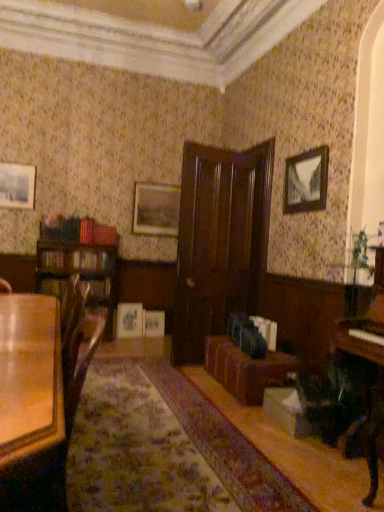
Describe the element at coordinates (156, 209) in the screenshot. I see `matte silver picture frame at center, which is the third picture frame from bottom to top` at that location.

You are a GUI agent. You are given a task and a screenshot of the screen. Output one action in this format:
    pyautogui.click(x=<x>, y=<y>)
    Task: Click on the dark wood door at center
    
    Given the screenshot: What is the action you would take?
    pyautogui.click(x=219, y=241)

What do you see at coordinates (219, 241) in the screenshot? This screenshot has width=384, height=512. I see `dark wood door at center` at bounding box center [219, 241].

What do you see at coordinates (30, 404) in the screenshot? I see `glossy wood table at lower left` at bounding box center [30, 404].

I want to click on matte wooden picture frame at center, the fifth picture frame from the front, so click(153, 323).

Measure the distance between point (27, 188) and camera.

Point (27, 188) is 15.63 feet away from camera.

Locate an element on the screen. The width and height of the screenshot is (384, 512). matte silver picture frame at center, the 3th picture frame in the top-to-bottom sequence is located at coordinates coord(156,209).

Is matte wooden picture frame at center, marked as the fifth picture frame in a top-to-bottom arrangement, placed right next to brown leather couch at center?

They are not placed beside each other.

Is matte wooden picture frame at center, marked as the fifth picture frame in a top-to-bottom arrangement, completely or partially outside of brown leather couch at center?

Yes, matte wooden picture frame at center, marked as the fifth picture frame in a top-to-bottom arrangement, is not within brown leather couch at center.

Is matte wooden picture frame at center, the fifth picture frame from the front, looking in the opposite direction of brown leather couch at center?

No.

Does brown leather couch at center have a greater width compared to wooden picture frame at upper right, the first picture frame when ordered from right to left?

Indeed, brown leather couch at center has a greater width compared to wooden picture frame at upper right, the first picture frame when ordered from right to left.

From a real-world perspective, relative to wooden picture frame at upper right, the fifth picture frame from the left, is brown leather couch at center vertically above or below?

From a real-world perspective, brown leather couch at center is physically below wooden picture frame at upper right, the fifth picture frame from the left.

Which of these two, brown leather couch at center or wooden picture frame at upper right, placed as the first picture frame when sorted from front to back, is smaller?

wooden picture frame at upper right, placed as the first picture frame when sorted from front to back.

From a real-world perspective, does glossy wood table at lower left sit lower than polished dark wood piano at right?

Yes.

Which is closer, [9,509] or [337,350]?

Point [9,509] appears to be closer to the viewer than point [337,350].

Between glossy wood table at lower left and polished dark wood piano at right, which one has less height?

Standing shorter between the two is glossy wood table at lower left.

Is glossy wood table at lower left surrounding polished dark wood piano at right?

No, polished dark wood piano at right is not surrounded by glossy wood table at lower left.

Who is shorter, polished dark wood piano at right or wooden picture frame at upper right, the first picture frame when ordered from right to left?

wooden picture frame at upper right, the first picture frame when ordered from right to left, is shorter.

From the image's perspective, which one is positioned higher, polished dark wood piano at right or wooden picture frame at upper right, acting as the second picture frame starting from the top?

wooden picture frame at upper right, acting as the second picture frame starting from the top.

From a real-world perspective, is polished dark wood piano at right beneath wooden picture frame at upper right, acting as the second picture frame starting from the top?

Yes.

Which is behind, point (243, 268) or point (32, 166)?

Point (32, 166)

Locate an element on the screen. door on the right of matte wooden picture frame at upper left, the second picture frame from the front is located at coordinates (219, 241).

Can you tell me how much dark wood door at center and matte wooden picture frame at upper left, the fourth picture frame viewed from the back, differ in facing direction?

The facing directions of dark wood door at center and matte wooden picture frame at upper left, the fourth picture frame viewed from the back, are 167 degrees apart.

Would you consider dark wood door at center to be distant from matte wooden picture frame at upper left, the fourth picture frame viewed from the back?

dark wood door at center is positioned a significant distance from matte wooden picture frame at upper left, the fourth picture frame viewed from the back.

Is dark wood door at center taller or shorter than matte silver picture frame at center, positioned as the fourth picture frame in front-to-back order?

dark wood door at center is taller than matte silver picture frame at center, positioned as the fourth picture frame in front-to-back order.

Is matte silver picture frame at center, the 3th picture frame in the top-to-bottom sequence, at the back of dark wood door at center?

No, matte silver picture frame at center, the 3th picture frame in the top-to-bottom sequence, is not at the back of dark wood door at center.

Considering the relative positions of dark wood door at center and matte silver picture frame at center, the 2th picture frame from the back, in the image provided, is dark wood door at center behind matte silver picture frame at center, the 2th picture frame from the back,?

No.

Consider the image. From the image's perspective, is dark wood door at center located above matte silver picture frame at center, positioned as the fourth picture frame in front-to-back order?

Actually, dark wood door at center appears below matte silver picture frame at center, positioned as the fourth picture frame in front-to-back order, in the image.

Is dark wood door at center touching wooden picture frame at upper right, acting as the second picture frame starting from the top?

dark wood door at center is not next to wooden picture frame at upper right, acting as the second picture frame starting from the top, and they're not touching.

Is dark wood door at center taller or shorter than wooden picture frame at upper right, acting as the second picture frame starting from the top?

Considering their sizes, dark wood door at center has more height than wooden picture frame at upper right, acting as the second picture frame starting from the top.

How far apart are dark wood door at center and wooden picture frame at upper right, placed as the 4th picture frame when sorted from bottom to top?

A distance of 29.81 inches exists between dark wood door at center and wooden picture frame at upper right, placed as the 4th picture frame when sorted from bottom to top.

From the picture: From a real-world perspective, is dark wood door at center physically below wooden picture frame at upper right, placed as the first picture frame when sorted from front to back?

Indeed, from a real-world perspective, dark wood door at center is positioned beneath wooden picture frame at upper right, placed as the first picture frame when sorted from front to back.

At what (x,y) coordinates should I click in order to perform the action: click on the 1st picture frame above the brown leather couch at center (from the image's perspective). Please return your answer as a coordinate pair (x, y). This screenshot has height=512, width=384. Looking at the image, I should click on (153, 323).

You are a GUI agent. You are given a task and a screenshot of the screen. Output one action in this format:
    pyautogui.click(x=<x>, y=<y>)
    Task: Click on the picture frame to the right of brown leather couch at center
    Image resolution: width=384 pixels, height=512 pixels.
    Given the screenshot: What is the action you would take?
    pyautogui.click(x=306, y=181)

When comparing their distances from matte silver picture frame at center, which is the third picture frame from bottom to top, does matte wooden picture frame at center, marked as the fifth picture frame in a top-to-bottom arrangement, or matte wooden picture frame at upper left, which ranks as the fifth picture frame in right-to-left order, seem closer?

The object closer to matte silver picture frame at center, which is the third picture frame from bottom to top, is matte wooden picture frame at upper left, which ranks as the fifth picture frame in right-to-left order.

When comparing their distances from matte white picture frame at center, which is the third picture frame in front-to-back order, does glossy wood table at lower left or brown leather couch at center seem closer?

The object closer to matte white picture frame at center, which is the third picture frame in front-to-back order, is brown leather couch at center.

When comparing their distances from glossy wood table at lower left, does matte wooden picture frame at center, which appears as the first picture frame when viewed from the back, or dark wood door at center seem further?

matte wooden picture frame at center, which appears as the first picture frame when viewed from the back, lies further to glossy wood table at lower left than the other object.

When comparing their distances from wooden picture frame at upper right, the first picture frame when ordered from right to left, does dark wood door at center or matte silver picture frame at center, positioned as the fourth picture frame in front-to-back order, seem further?

matte silver picture frame at center, positioned as the fourth picture frame in front-to-back order, lies further to wooden picture frame at upper right, the first picture frame when ordered from right to left, than the other object.

Based on their spatial positions, is matte white picture frame at center, which is the third picture frame in front-to-back order, or glossy wood table at lower left further from matte wooden picture frame at upper left, which ranks as the fifth picture frame in right-to-left order?

glossy wood table at lower left is positioned further to the anchor matte wooden picture frame at upper left, which ranks as the fifth picture frame in right-to-left order.

When comparing their distances from dark wood door at center, does matte wooden picture frame at upper left, the second picture frame from the front, or matte white picture frame at center, marked as the fourth picture frame in a right-to-left arrangement, seem further?

matte wooden picture frame at upper left, the second picture frame from the front, lies further to dark wood door at center than the other object.

Which object lies nearer to the anchor point dark wood door at center, wooden picture frame at upper right, which is counted as the fifth picture frame, starting from the back, or glossy wood table at lower left?

wooden picture frame at upper right, which is counted as the fifth picture frame, starting from the back, is closer to dark wood door at center.

Which object lies nearer to the anchor point matte white picture frame at center, placed as the fourth picture frame when sorted from top to bottom, glossy wood table at lower left or matte wooden picture frame at center, marked as the fifth picture frame in a top-to-bottom arrangement?

matte wooden picture frame at center, marked as the fifth picture frame in a top-to-bottom arrangement, is positioned closer to the anchor matte white picture frame at center, placed as the fourth picture frame when sorted from top to bottom.

Locate an element on the screen. The width and height of the screenshot is (384, 512). door between glossy wood table at lower left and matte white picture frame at center, the third picture frame when ordered from back to front, in the front-back direction is located at coordinates (219, 241).

Identify the location of picture frame positioned between glossy wood table at lower left and matte wooden picture frame at upper left, the fifth picture frame positioned from the bottom, from near to far. The image size is (384, 512). (306, 181).

Locate an element on the screen. door between glossy wood table at lower left and matte wooden picture frame at center, marked as the fifth picture frame in a top-to-bottom arrangement, along the z-axis is located at coordinates (219, 241).

The width and height of the screenshot is (384, 512). I want to click on door located between matte wooden picture frame at upper left, the second picture frame from the front, and brown leather couch at center in the left-right direction, so click(x=219, y=241).